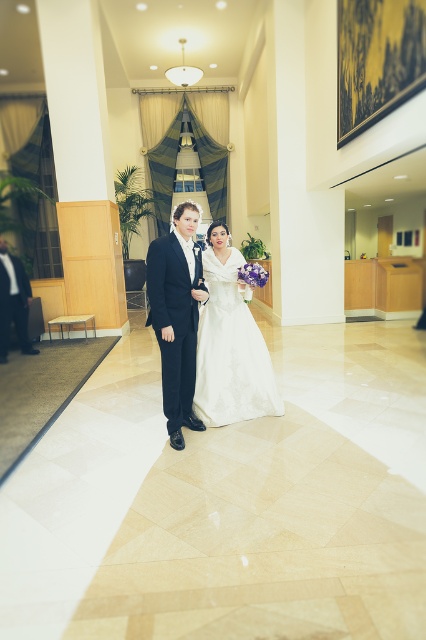
Does white satin dress at center appear on the left side of dark blue suit at center?

Incorrect, white satin dress at center is not on the left side of dark blue suit at center.

Which is below, white satin dress at center or dark blue suit at center?

dark blue suit at center is below.

Between point (264, 381) and point (158, 244), which one is positioned in front?

Positioned in front is point (158, 244).

At what (x,y) coordinates should I click in order to perform the action: click on white satin dress at center. Please return your answer as a coordinate pair (x, y). This screenshot has height=640, width=426. Looking at the image, I should click on (230, 342).

Measure the distance between dark blue suit at center and camera.

dark blue suit at center is 3.08 meters from camera.

Locate an element on the screen. The height and width of the screenshot is (640, 426). dark blue suit at center is located at coordinates (176, 316).

Is white satin dress at center in front of matte black suit at left?

Yes, white satin dress at center is closer to the viewer.

Is white satin dress at center positioned at the back of matte black suit at left?

No, it is not.

The height and width of the screenshot is (640, 426). Identify the location of white satin dress at center. (230, 342).